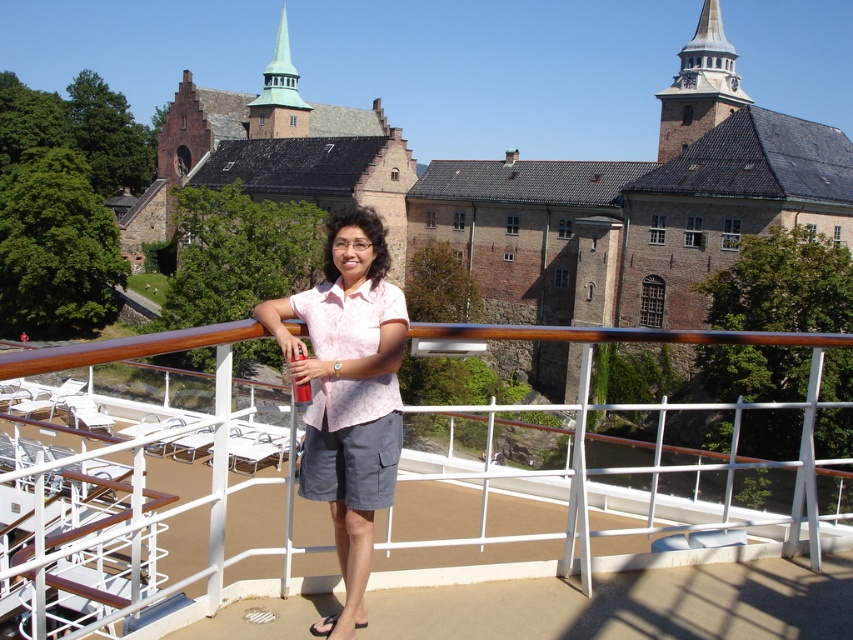
You are a photographer trying to capture a photo of the historic building in the background. You notice the pink floral shirt at center and the white metal railing at center in your frame. Based on their sizes in the image, which object would likely be closer to you?

The pink floral shirt at center has a smaller size compared to the white metal railing at center, so the white metal railing at center is closer to you because objects closer to the camera appear larger.